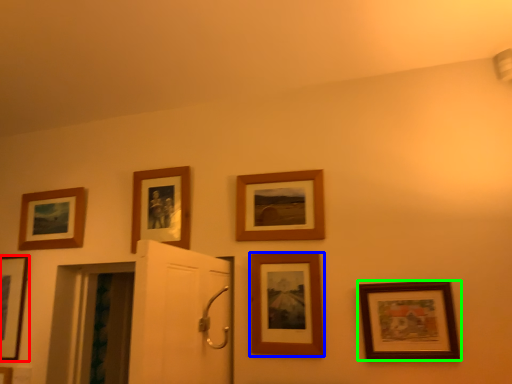
Question: Considering the real-world distances, which object is closest to picture frame (highlighted by a red box)? picture frame (highlighted by a blue box) or picture frame (highlighted by a green box).

Choices:
 (A) picture frame
 (B) picture frame

Answer: (A)